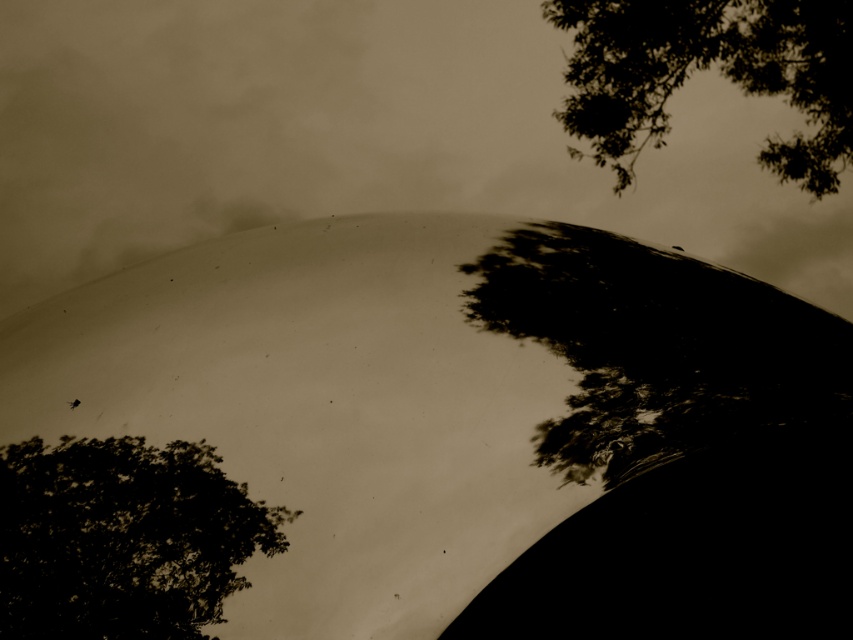
You are an artist sketching the scene. You want to draw the white matte cloud at center and the dark green leafy tree at lower left. Which object should you draw first if you follow the rule of starting with the object that is more to the right?

The white matte cloud at center should be drawn first because it is positioned on the right side of the dark green leafy tree at lower left, meaning it is more to the right in the scene.

You are an architect designing a new garden layout. You need to place a statue that is 2 meters tall between the white matte cloud at center and the dark green leafy tree at lower left. Considering their heights, which object will the statue be taller than?

The white matte cloud at center is much taller than the dark green leafy tree at lower left. Since the statue is 2 meters tall, it will be taller than the dark green leafy tree at lower left but shorter than the white matte cloud at center.